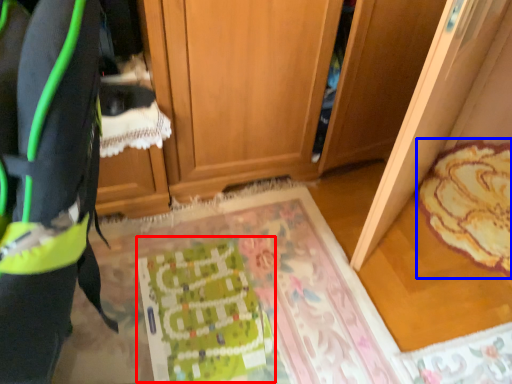
Question: Which point is further to the camera, wrapping paper (highlighted by a red box) or mat (highlighted by a blue box)?

Choices:
 (A) wrapping paper
 (B) mat

Answer: (B)